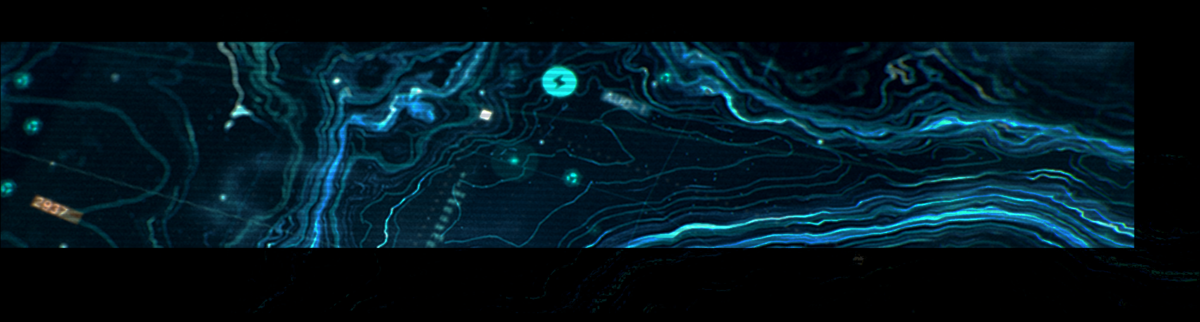
At what (x,y) coordinates should I click in order to perform the action: click on three small blue lights. Please return your answer as a coordinate pair (x, y). Looking at the image, I should click on pos(570,177).